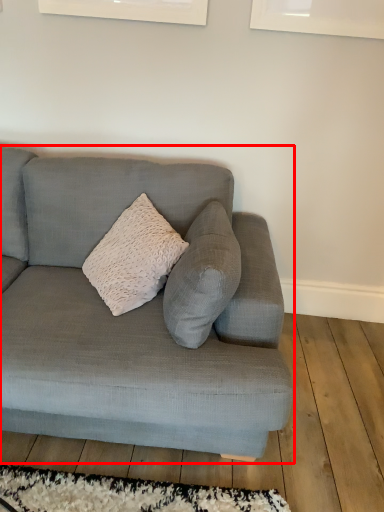
Question: From the image's perspective, where is studio couch (annotated by the red box) located relative to mat?

Choices:
 (A) below
 (B) above

Answer: (B)